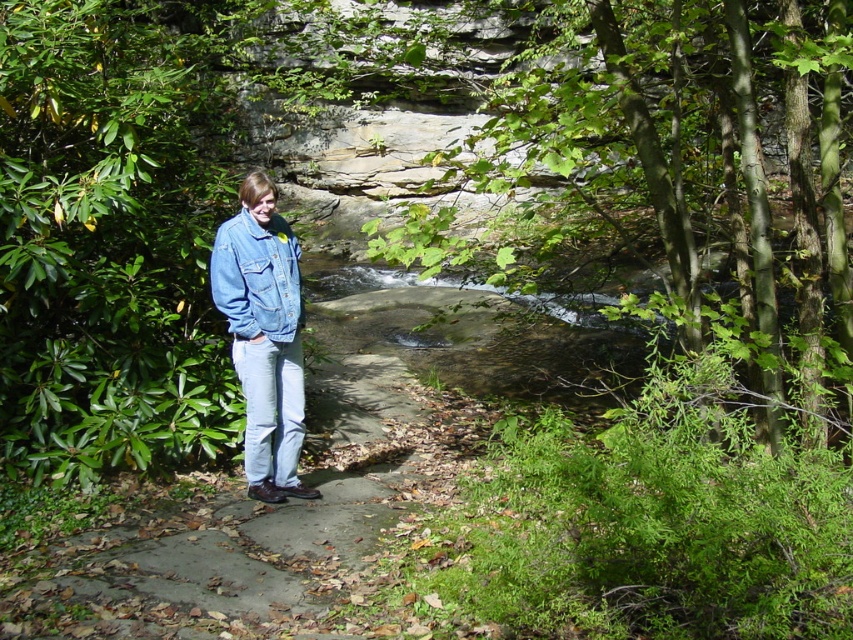
Does denim jacket at center have a greater width compared to denim jacket at lower right?

Yes.

Is point (230, 324) farther from camera compared to point (242, 317)?

Yes, point (230, 324) is behind point (242, 317).

At what (x,y) coordinates should I click in order to perform the action: click on denim jacket at center. Please return your answer as a coordinate pair (x, y). Looking at the image, I should click on (263, 337).